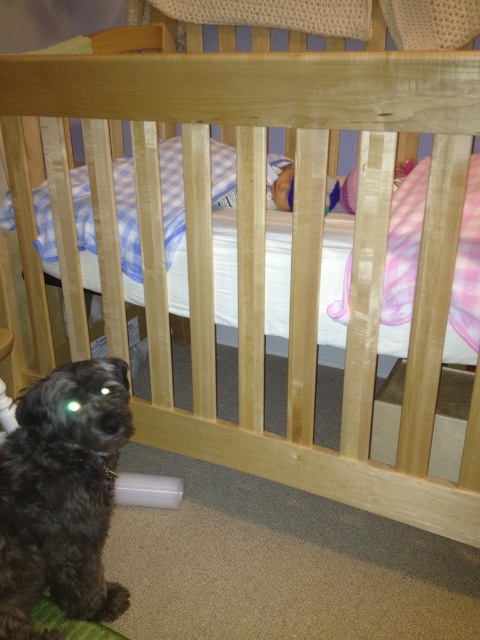
How much distance is there between black fuzzy dog at lower left and pink satin baby at center?

39.10 inches

Which of these two, black fuzzy dog at lower left or pink satin baby at center, stands shorter?

pink satin baby at center is shorter.

Identify the location of black fuzzy dog at lower left. The width and height of the screenshot is (480, 640). (61, 496).

Find the location of a particular element. This screenshot has width=480, height=640. black fuzzy dog at lower left is located at coordinates (61, 496).